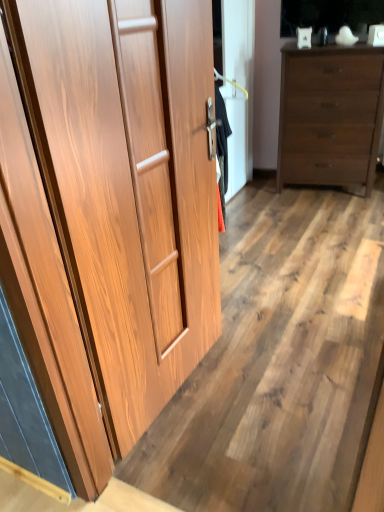
Find the location of a particular element. This screenshot has height=512, width=384. free space between wooden cupboard at left and matte brown dresser at right is located at coordinates (278, 247).